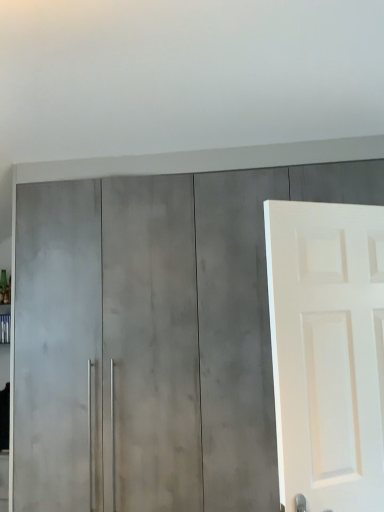
Question: Should I look upward or downward to see satin gray cabinet at center?

Choices:
 (A) down
 (B) up

Answer: (A)

Question: Does white matte door at right have a greater width compared to satin gray cabinet at center?

Choices:
 (A) yes
 (B) no

Answer: (B)

Question: Is white matte door at right at the right side of satin gray cabinet at center?

Choices:
 (A) yes
 (B) no

Answer: (A)

Question: From a real-world perspective, is white matte door at right positioned under satin gray cabinet at center based on gravity?

Choices:
 (A) no
 (B) yes

Answer: (A)

Question: From the image's perspective, would you say white matte door at right is positioned over satin gray cabinet at center?

Choices:
 (A) no
 (B) yes

Answer: (B)

Question: From a real-world perspective, is white matte door at right physically above satin gray cabinet at center?

Choices:
 (A) no
 (B) yes

Answer: (B)

Question: Does white matte door at right turn towards satin gray cabinet at center?

Choices:
 (A) no
 (B) yes

Answer: (A)

Question: Considering the relative sizes of satin gray cabinet at center and white matte door at right in the image provided, is satin gray cabinet at center bigger than white matte door at right?

Choices:
 (A) no
 (B) yes

Answer: (B)

Question: Considering the relative sizes of satin gray cabinet at center and white matte door at right in the image provided, is satin gray cabinet at center shorter than white matte door at right?

Choices:
 (A) no
 (B) yes

Answer: (A)

Question: Does satin gray cabinet at center have a greater height compared to white matte door at right?

Choices:
 (A) yes
 (B) no

Answer: (A)

Question: Does satin gray cabinet at center touch white matte door at right?

Choices:
 (A) no
 (B) yes

Answer: (A)

Question: From the image's perspective, is satin gray cabinet at center on white matte door at right?

Choices:
 (A) yes
 (B) no

Answer: (B)

Question: Does satin gray cabinet at center lie in front of white matte door at right?

Choices:
 (A) no
 (B) yes

Answer: (A)

Question: Considering the positions of white matte door at right and satin gray cabinet at center in the image, is white matte door at right wider or thinner than satin gray cabinet at center?

Choices:
 (A) wide
 (B) thin

Answer: (B)